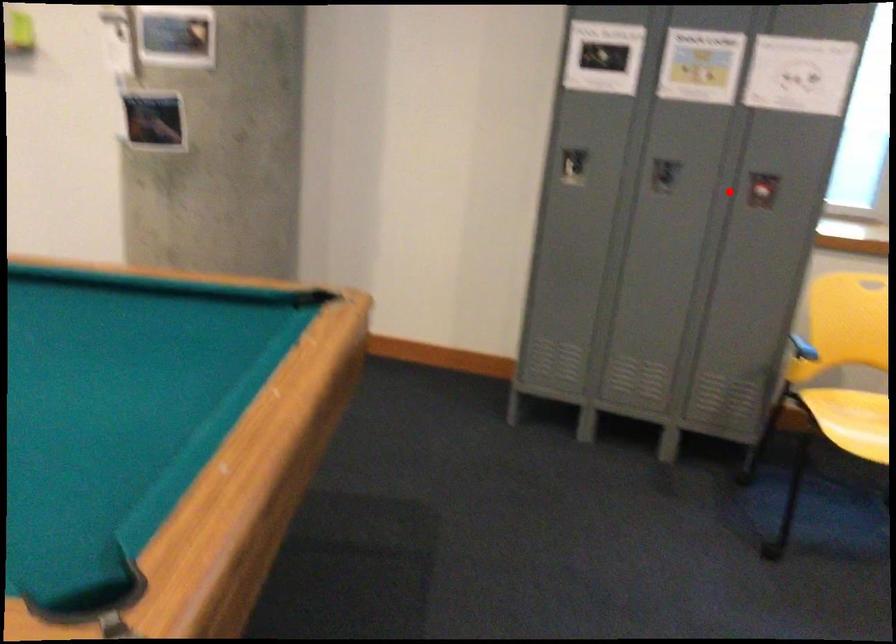
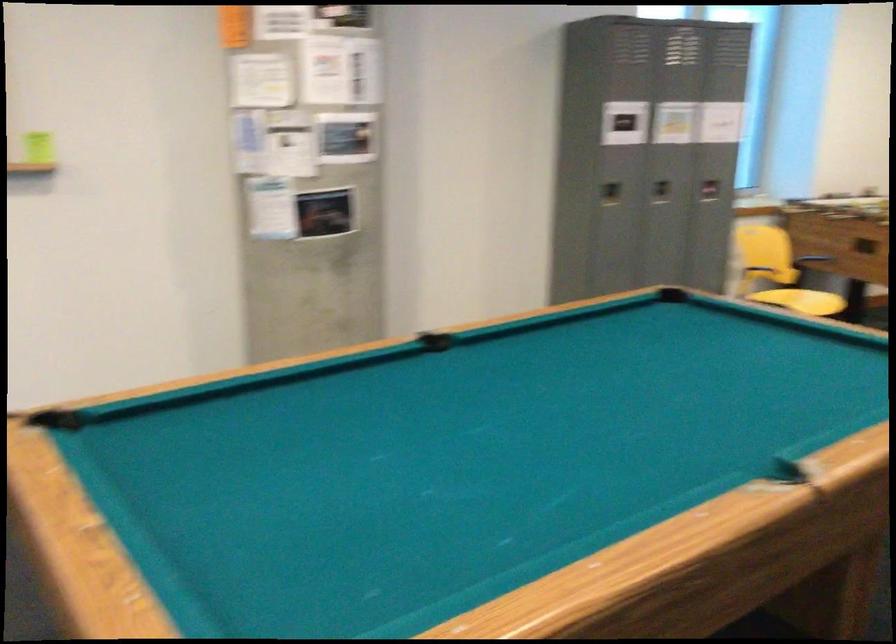
Where in the second image is the point corresponding to the highlighted location from the first image?

(710, 190)